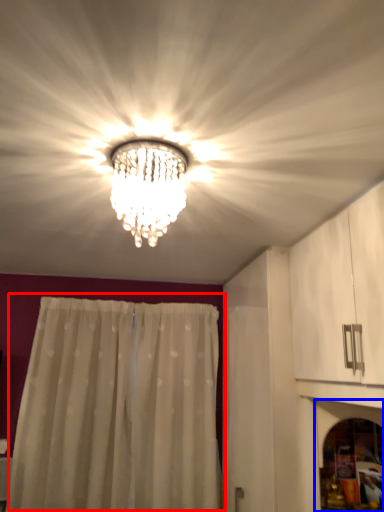
Question: Among these objects, which one is farthest to the camera, curtain (highlighted by a red box) or screen door (highlighted by a blue box)?

Choices:
 (A) curtain
 (B) screen door

Answer: (A)